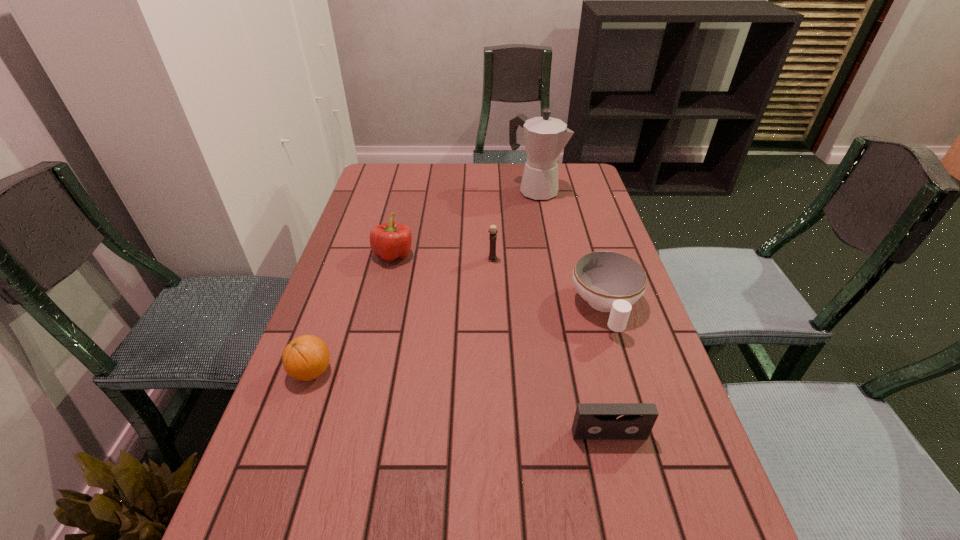
This screenshot has width=960, height=540. I want to click on the farthest object, so click(545, 137).

The image size is (960, 540). What are the coordinates of `the tallest object` in the screenshot? It's located at (545, 137).

You are a GUI agent. You are given a task and a screenshot of the screen. Output one action in this format:
    pyautogui.click(x=<x>, y=<y>)
    Task: Click on the candle holder
    The height and width of the screenshot is (540, 960).
    Given the screenshot: What is the action you would take?
    pyautogui.click(x=492, y=257)

Locate an element on the screen. The image size is (960, 540). bell pepper is located at coordinates (389, 241).

Image resolution: width=960 pixels, height=540 pixels. I want to click on chinaware, so tap(611, 282).

This screenshot has width=960, height=540. Find the location of `orange`. orange is located at coordinates (305, 358).

The width and height of the screenshot is (960, 540). Find the location of `the leftmost object`. the leftmost object is located at coordinates (305, 358).

Locate an element on the screen. This screenshot has height=540, width=960. the nearest object is located at coordinates (593, 421).

Find the location of a particular element. The width and height of the screenshot is (960, 540). free location located 0.100m on the right of the coffeepot is located at coordinates (591, 191).

At what (x,y) coordinates should I click in order to perform the action: click on vacant space situated 0.230m on the right of the candle holder. Please return your answer as a coordinate pair (x, y). This screenshot has width=960, height=540. Looking at the image, I should click on (578, 259).